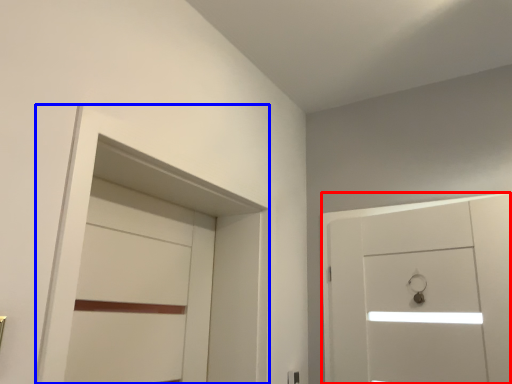
Question: Which of the following is the farthest to the observer, door (highlighted by a red box) or locker (highlighted by a blue box)?

Choices:
 (A) door
 (B) locker

Answer: (A)